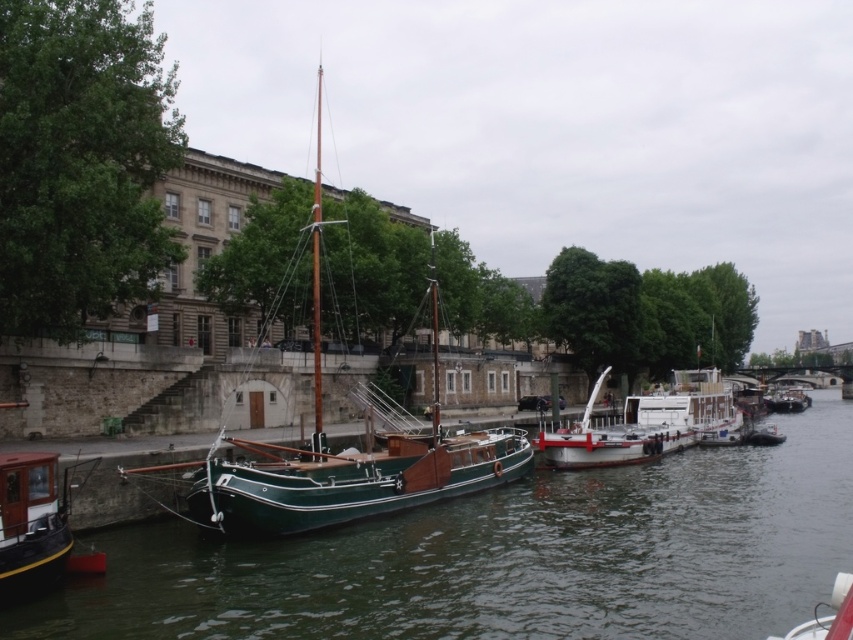
You are a photographer standing on the riverside bank. You want to take a photo that includes both the green wooden boat at center and the green polished wood sailboat at center. Which boat should you position closer to the camera to ensure both are fully visible in the frame?

You should position the green wooden boat at center closer to the camera because it is in front of the green polished wood sailboat at center, so placing it nearer ensures both are visible without one blocking the other.

You are a photographer standing on the riverside bank. You want to capture a photo that includes both the brushed metal boat at lower left and the white matte boat at center. Which boat should you position closer to the edge of your camera frame to ensure both are in the shot?

You should position the brushed metal boat at lower left closer to the edge of your camera frame because it is closer to the viewer than the white matte boat at center, so it will naturally appear larger in the frame. This allows both boats to be included without one overlapping the other excessively.